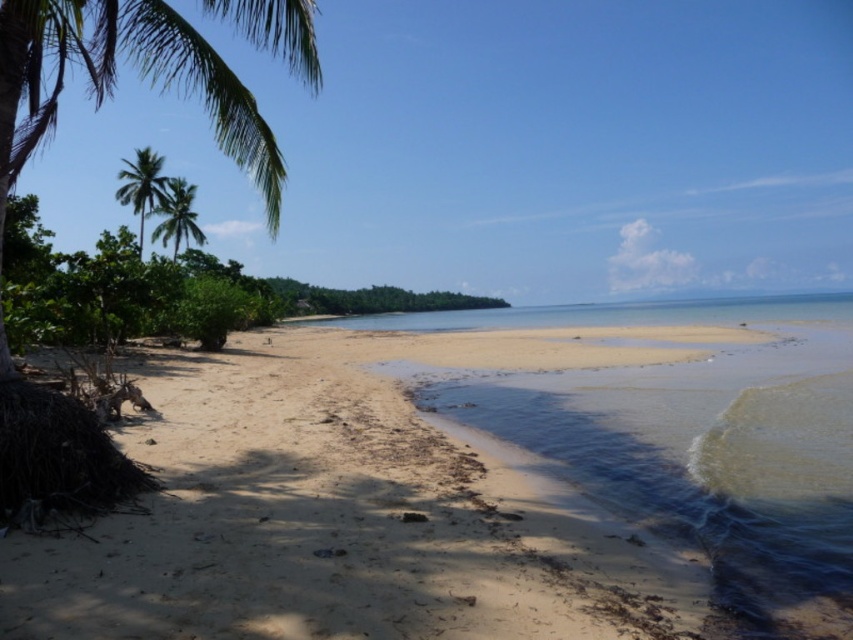
At what (x,y) coordinates should I click in order to perform the action: click on sandy beach at lower left. Please return your answer as a coordinate pair (x, y). This screenshot has height=640, width=853. Looking at the image, I should click on (469, 486).

Is point (801, 636) positioned in front of point (160, 182)?

Yes, it is.

Find the location of a particular element. sandy beach at lower left is located at coordinates (469, 486).

Who is higher up, sandy beach at lower left or green leafy palm tree at left?

Positioned higher is green leafy palm tree at left.

The height and width of the screenshot is (640, 853). In order to click on sandy beach at lower left in this screenshot , I will do `click(469, 486)`.

The image size is (853, 640). Find the location of `sandy beach at lower left`. sandy beach at lower left is located at coordinates (469, 486).

Between point (154, 170) and point (163, 212), which one is positioned behind?

Point (163, 212)

Who is positioned more to the left, green leafy palm tree at upper left or green leafy palm tree at left?

Positioned to the left is green leafy palm tree at upper left.

Measure the distance between point [132,195] and camera.

They are 64.77 meters apart.

Find the location of a particular element. Image resolution: width=853 pixels, height=640 pixels. green leafy palm tree at upper left is located at coordinates (141, 186).